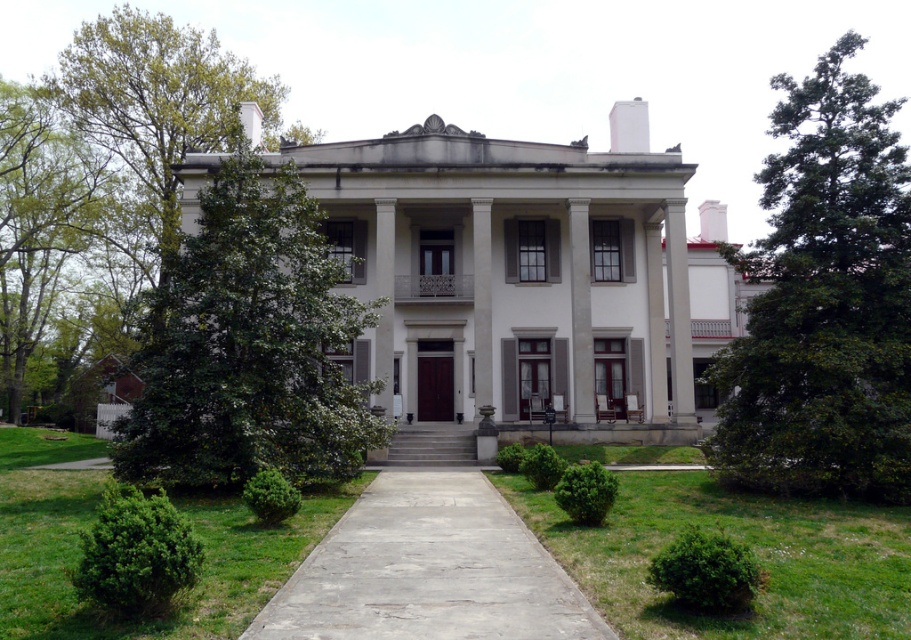
Which of these two, white smooth mansion at center or green leafy tree at center, stands shorter?

Standing shorter between the two is green leafy tree at center.

From the picture: Is white smooth mansion at center wider than green leafy tree at center?

Yes.

Is point (579, 358) in front of point (246, 429)?

No.

Locate an element on the screen. white smooth mansion at center is located at coordinates (529, 278).

Is point (476, 509) behind point (59, 525)?

Yes, point (476, 509) is farther from viewer.

Which of these two, gray concrete pathway at center or green grass at lower left, stands shorter?

gray concrete pathway at center is shorter.

Who is more distant from viewer, (x=398, y=577) or (x=366, y=474)?

The point (x=366, y=474) is behind.

Identify the location of gray concrete pathway at center. Image resolution: width=911 pixels, height=640 pixels. (428, 570).

Is point (308, 433) positioned in front of point (631, 572)?

No, (308, 433) is further to viewer.

Between green leafy tree at center and green grass at center, which one has more height?

Standing taller between the two is green grass at center.

The width and height of the screenshot is (911, 640). What do you see at coordinates (249, 346) in the screenshot?
I see `green leafy tree at center` at bounding box center [249, 346].

At what (x,y) coordinates should I click in order to perform the action: click on green leafy tree at center. Please return your answer as a coordinate pair (x, y). This screenshot has width=911, height=640. Looking at the image, I should click on (249, 346).